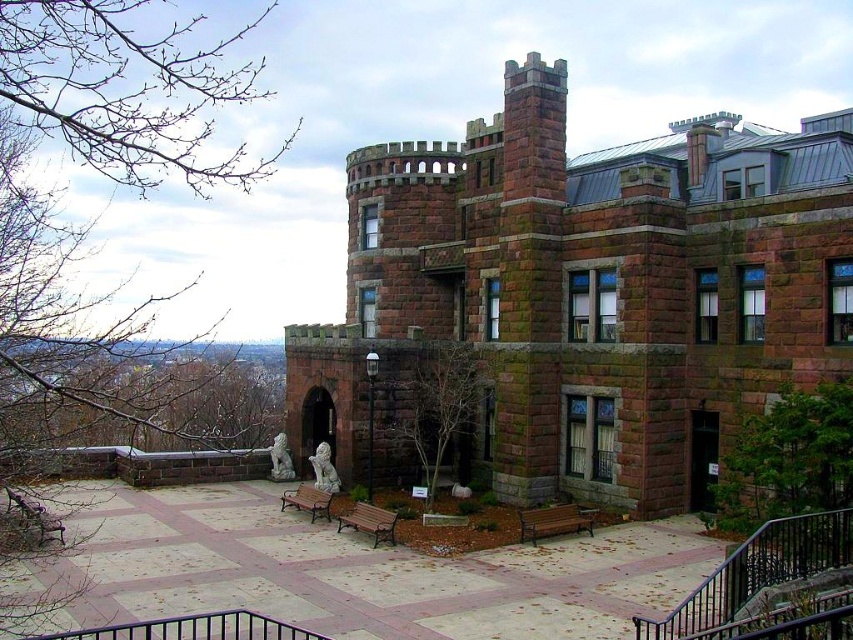
You are standing in the courtyard of the historic building. You see a point marked at coordinates (554, 522). Which object is this point located on?

The point at (554, 522) is located on the brown wooden bench at lower center.

You are planning to host a small gathering in the courtyard of the historic building. You need to seat 10 guests comfortably. Which bench between the wooden bench at lower left and the metallic polished bench at center can accommodate more people?

The wooden bench at lower left is larger in size than the metallic polished bench at center, so it can accommodate more people.